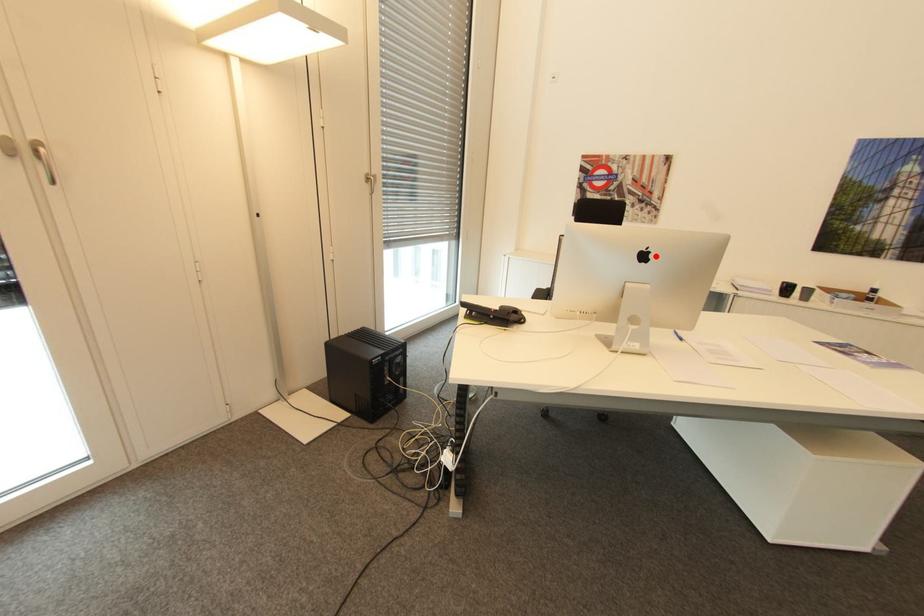
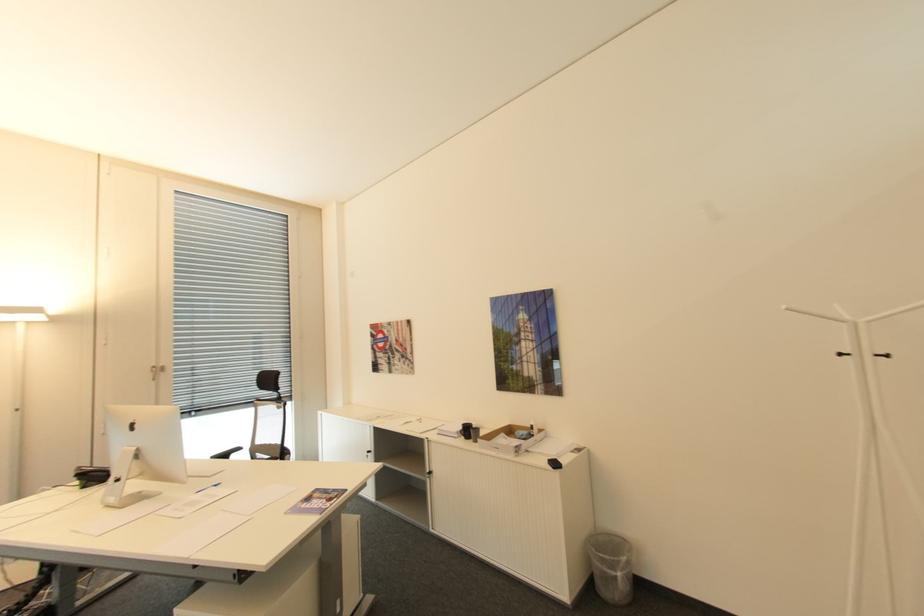
The point at the highlighted location is marked in the first image. Where is the corresponding point in the second image?

(140, 426)